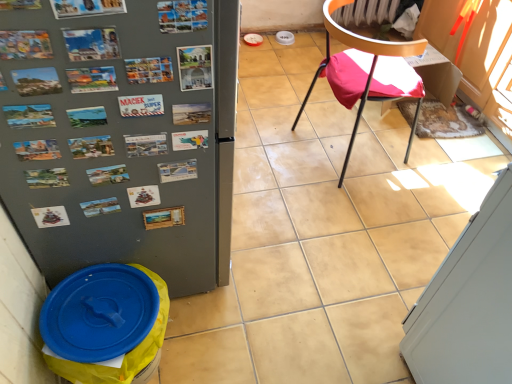
Question: Does metallic postcards at upper center have a lesser height compared to metallic black chair at center right?

Choices:
 (A) no
 (B) yes

Answer: (B)

Question: Is metallic postcards at upper center positioned behind metallic black chair at center right?

Choices:
 (A) no
 (B) yes

Answer: (A)

Question: Is metallic black chair at center right surrounded by metallic postcards at upper center?

Choices:
 (A) yes
 (B) no

Answer: (B)

Question: Is metallic postcards at upper center closer to the viewer compared to metallic black chair at center right?

Choices:
 (A) yes
 (B) no

Answer: (A)

Question: From the image's perspective, is metallic postcards at upper center on top of metallic black chair at center right?

Choices:
 (A) no
 (B) yes

Answer: (A)

Question: From the image's perspective, relative to metallic black chair at center right, is white glossy screen door at lower right above or below?

Choices:
 (A) above
 (B) below

Answer: (B)

Question: Looking at their shapes, would you say white glossy screen door at lower right is wider or thinner than metallic black chair at center right?

Choices:
 (A) thin
 (B) wide

Answer: (A)

Question: Based on their sizes in the image, would you say white glossy screen door at lower right is bigger or smaller than metallic black chair at center right?

Choices:
 (A) small
 (B) big

Answer: (A)

Question: Considering the positions of point (468, 263) and point (373, 19), is point (468, 263) closer or farther from the camera than point (373, 19)?

Choices:
 (A) farther
 (B) closer

Answer: (B)

Question: Is metallic postcards at upper center bigger or smaller than white glossy screen door at lower right?

Choices:
 (A) small
 (B) big

Answer: (A)

Question: Is metallic postcards at upper center situated inside white glossy screen door at lower right or outside?

Choices:
 (A) outside
 (B) inside

Answer: (A)

Question: From a real-world perspective, is metallic postcards at upper center physically located above or below white glossy screen door at lower right?

Choices:
 (A) above
 (B) below

Answer: (A)

Question: Considering their positions, is metallic postcards at upper center located in front of or behind white glossy screen door at lower right?

Choices:
 (A) front
 (B) behind

Answer: (B)

Question: From a real-world perspective, is white glossy screen door at lower right positioned above or below blue plastic lid at lower left?

Choices:
 (A) above
 (B) below

Answer: (A)

Question: Considering the relative positions of white glossy screen door at lower right and blue plastic lid at lower left in the image provided, is white glossy screen door at lower right to the left or to the right of blue plastic lid at lower left?

Choices:
 (A) right
 (B) left

Answer: (A)